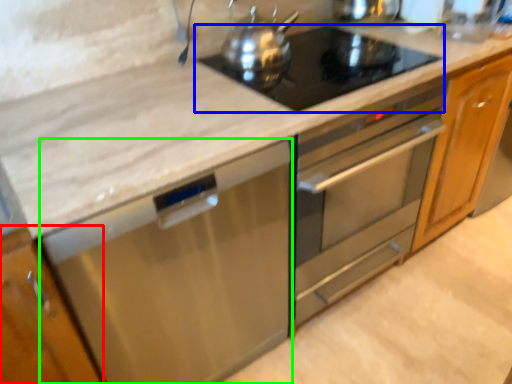
Question: Which object is positioned farthest from cabinetry (highlighted by a red box)? Select from gas stove (highlighted by a blue box) and dish washer (highlighted by a green box).

Choices:
 (A) gas stove
 (B) dish washer

Answer: (A)